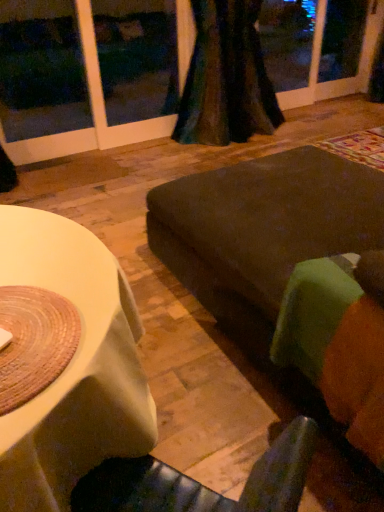
Where is `vacant area that is in front of velvet dark green curtain at upper center`? vacant area that is in front of velvet dark green curtain at upper center is located at coordinates [x=200, y=160].